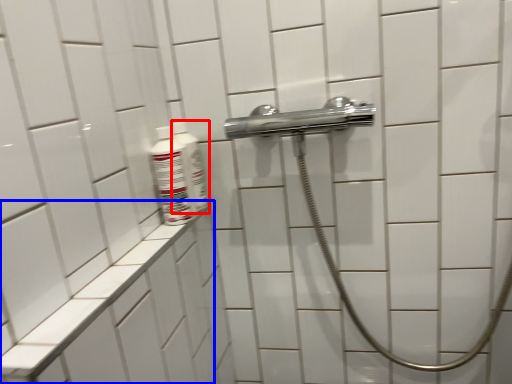
Question: Which point is closer to the camera, mouthwash (highlighted by a red box) or ledge (highlighted by a blue box)?

Choices:
 (A) mouthwash
 (B) ledge

Answer: (B)